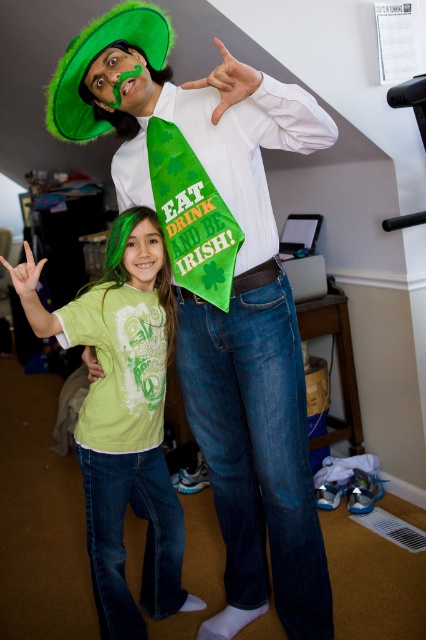
Which is below, green fuzzy hat at upper left or matte green face at center?

matte green face at center is lower down.

Does green fuzzy hat at upper left have a greater width compared to matte green face at center?

Yes, green fuzzy hat at upper left is wider than matte green face at center.

Describe the element at coordinates (92, 58) in the screenshot. The image size is (426, 640). I see `green fuzzy hat at upper left` at that location.

What are the coordinates of `green fuzzy hat at upper left` in the screenshot? It's located at (92, 58).

Does green felt hat at upper left lie in front of green fuzzy hat at upper left?

Yes, green felt hat at upper left is in front of green fuzzy hat at upper left.

Is green felt hat at upper left smaller than green fuzzy hat at upper left?

Incorrect, green felt hat at upper left is not smaller in size than green fuzzy hat at upper left.

Who is more forward, (138, 136) or (65, 77)?

Point (65, 77) is more forward.

The image size is (426, 640). Find the location of `green felt hat at upper left`. green felt hat at upper left is located at coordinates (227, 307).

Between green matte shirt at center and green matte mustache at center, which one is positioned higher?

Positioned higher is green matte mustache at center.

Describe the element at coordinates (121, 429) in the screenshot. The width and height of the screenshot is (426, 640). I see `green matte shirt at center` at that location.

Looking at this image, measure the distance between green matte shirt at center and camera.

A distance of 1.05 meters exists between green matte shirt at center and camera.

I want to click on green matte shirt at center, so click(x=121, y=429).